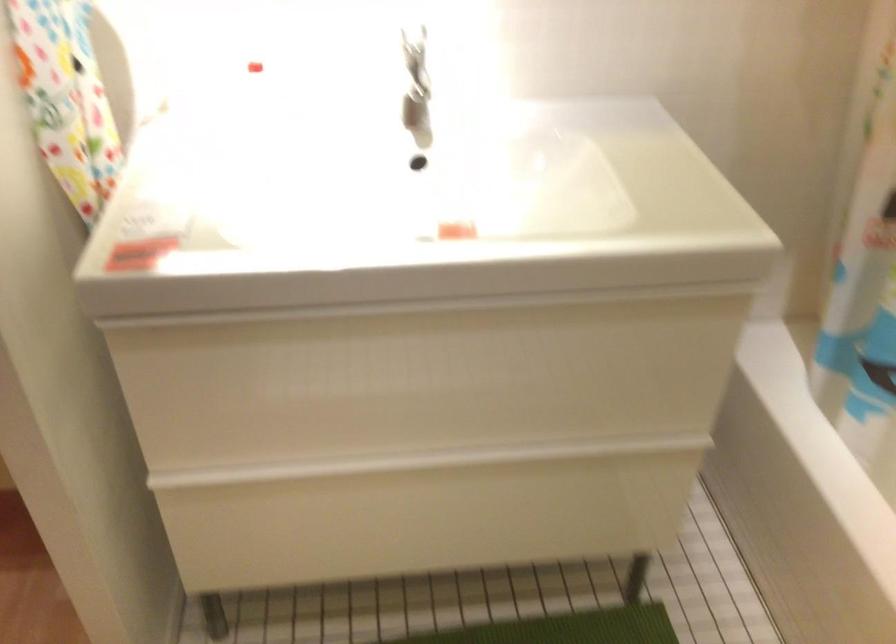
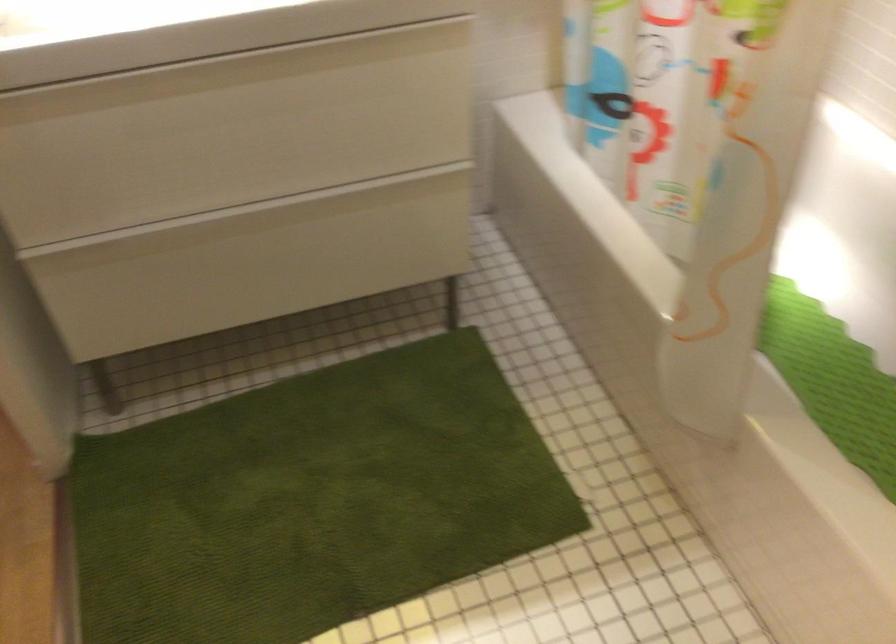
The point at [443,312] is marked in the first image. Where is the corresponding point in the second image?

(228, 70)